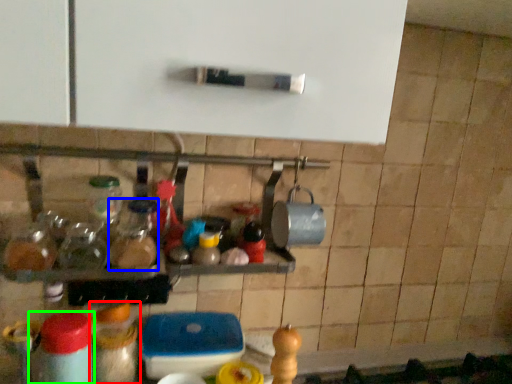
Question: Based on their relative distances, which object is nearer to bottle (highlighted by a red box)? Choose from bottle (highlighted by a blue box) and bottle (highlighted by a green box).

Choices:
 (A) bottle
 (B) bottle

Answer: (B)